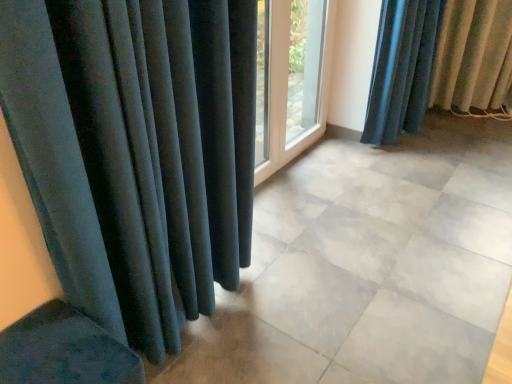
The height and width of the screenshot is (384, 512). What do you see at coordinates (438, 62) in the screenshot? I see `velvet dark blue curtain at right` at bounding box center [438, 62].

Measure the distance between point [407,87] and camera.

The distance of point [407,87] from camera is 8.67 feet.

Where is `velvet dark blue curtain at right`? velvet dark blue curtain at right is located at coordinates (438, 62).

Image resolution: width=512 pixels, height=384 pixels. Describe the element at coordinates (304, 65) in the screenshot. I see `white glass door at center` at that location.

At what (x,y) coordinates should I click in order to perform the action: click on white glass door at center. Please return your answer as a coordinate pair (x, y). Image resolution: width=512 pixels, height=384 pixels. Looking at the image, I should click on (304, 65).

You are a GUI agent. You are given a task and a screenshot of the screen. Output one action in this format:
    pyautogui.click(x=<x>, y=<y>)
    Task: Click on the velvet dark blue curtain at right
    The width and height of the screenshot is (512, 384).
    Given the screenshot: What is the action you would take?
    pyautogui.click(x=438, y=62)

Consider the image. Considering the relative positions of velvet dark blue curtain at right and white glass door at center in the image provided, is velvet dark blue curtain at right to the right of white glass door at center from the viewer's perspective?

Indeed, velvet dark blue curtain at right is positioned on the right side of white glass door at center.

Is velvet dark blue curtain at right further to camera compared to white glass door at center?

Yes, it is.

Between point (386, 18) and point (310, 2), which one is positioned in front?

Positioned in front is point (386, 18).

From the image's perspective, is velvet dark blue curtain at right located above or below white glass door at center?

Based on their image positions, velvet dark blue curtain at right is located above white glass door at center.

From a real-world perspective, relative to white glass door at center, is velvet dark blue curtain at right vertically above or below?

In terms of real-world spatial position, velvet dark blue curtain at right is below white glass door at center.

Considering the sizes of objects velvet dark blue curtain at right and white glass door at center in the image provided, who is thinner, velvet dark blue curtain at right or white glass door at center?

white glass door at center is thinner.

Can you confirm if velvet dark blue curtain at right is taller than white glass door at center?

Incorrect, the height of velvet dark blue curtain at right is not larger of that of white glass door at center.

Who is smaller, velvet dark blue curtain at right or white glass door at center?

white glass door at center is smaller.

From the picture: Is velvet dark blue curtain at right not within white glass door at center?

Yes, velvet dark blue curtain at right is located beyond the bounds of white glass door at center.

Is velvet dark blue curtain at right positioned far away from white glass door at center?

Indeed, velvet dark blue curtain at right is not near white glass door at center.

Based on the photo, is white glass door at center at the back of velvet dark blue curtain at right?

No.

How different are the orientations of velvet dark blue curtain at right and white glass door at center in degrees?

The facing directions of velvet dark blue curtain at right and white glass door at center are 2.1 degrees apart.

I want to click on curtain located behind the white glass door at center, so click(x=438, y=62).

Between white glass door at center and velvet dark blue curtain at right, which one appears on the left side from the viewer's perspective?

white glass door at center.

Which object is closer to the camera, white glass door at center or velvet dark blue curtain at right?

white glass door at center is more forward.

Considering the positions of point (298, 93) and point (485, 1), is point (298, 93) closer or farther from the camera than point (485, 1)?

Point (298, 93) is positioned farther from the camera compared to point (485, 1).

From the image's perspective, would you say white glass door at center is shown under velvet dark blue curtain at right?

Yes, from the image's perspective, white glass door at center is beneath velvet dark blue curtain at right.

From a real-world perspective, which object rests below the other?

velvet dark blue curtain at right is physically lower.

Can you confirm if white glass door at center is wider than velvet dark blue curtain at right?

Incorrect, the width of white glass door at center does not surpass that of velvet dark blue curtain at right.

Which of these two, white glass door at center or velvet dark blue curtain at right, stands taller?

Standing taller between the two is white glass door at center.

Considering the sizes of objects white glass door at center and velvet dark blue curtain at right in the image provided, who is bigger, white glass door at center or velvet dark blue curtain at right?

Bigger between the two is velvet dark blue curtain at right.

Is velvet dark blue curtain at right a part of white glass door at center?

No, velvet dark blue curtain at right is not a part of white glass door at center.

Is white glass door at center positioned far away from velvet dark blue curtain at right?

That's right, there is a large distance between white glass door at center and velvet dark blue curtain at right.

Is white glass door at center looking in the opposite direction of velvet dark blue curtain at right?

No, white glass door at center's orientation is not away from velvet dark blue curtain at right.

I want to click on window frame that appears below the velvet dark blue curtain at right (from the image's perspective), so click(x=304, y=65).

Image resolution: width=512 pixels, height=384 pixels. In order to click on curtain located underneath the white glass door at center (from a real-world perspective) in this screenshot , I will do `click(438, 62)`.

Where is `curtain behind the white glass door at center`? The width and height of the screenshot is (512, 384). curtain behind the white glass door at center is located at coordinates coord(438,62).